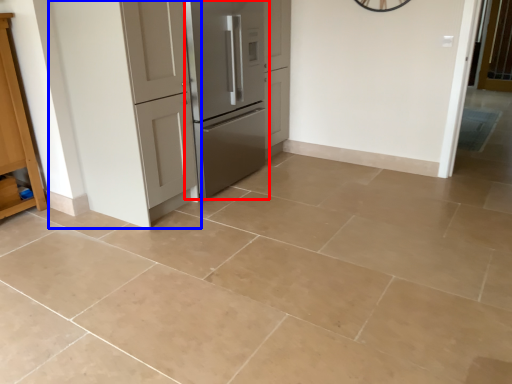
Question: Which point is closer to the camera, refrigerator (highlighted by a red box) or door (highlighted by a blue box)?

Choices:
 (A) refrigerator
 (B) door

Answer: (B)